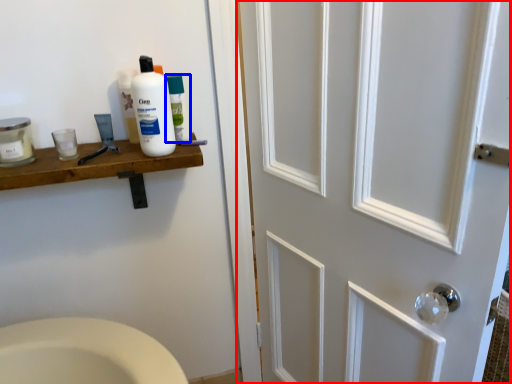
Question: Which object is further to the camera taking this photo, door (highlighted by a red box) or mouthwash (highlighted by a blue box)?

Choices:
 (A) door
 (B) mouthwash

Answer: (B)